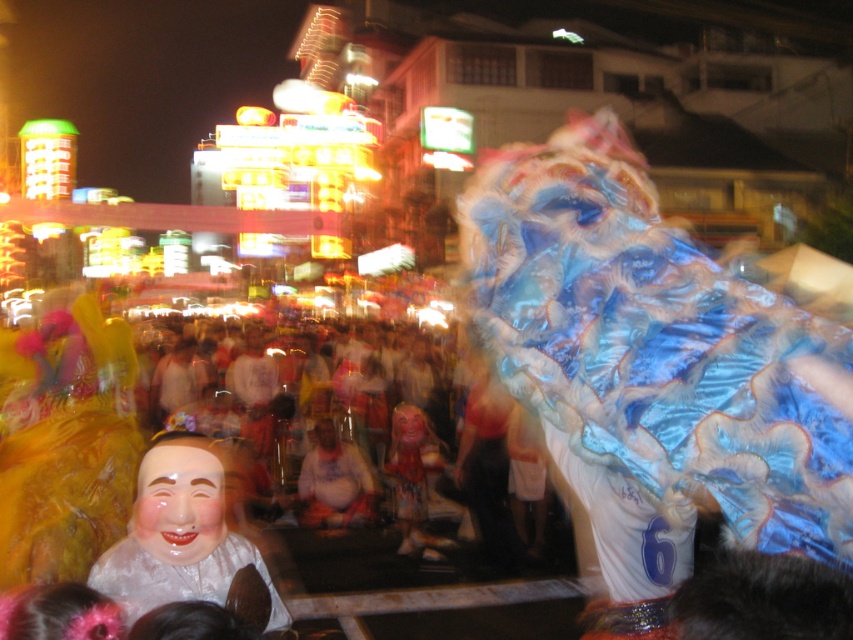
You are a photographer trying to capture a photo of the shiny blue fabric dragon at center and the smooth porcelain mask at center. Given that your camera has a maximum focus range of 15 meters, can you take a photo of both objects clearly without moving your position?

The smooth porcelain mask at center is 15.26 meters away from the shiny blue fabric dragon at center. Since the distance between them exceeds the camera maximum focus range of 15 meters, you cannot take a photo of both objects clearly without moving your position.